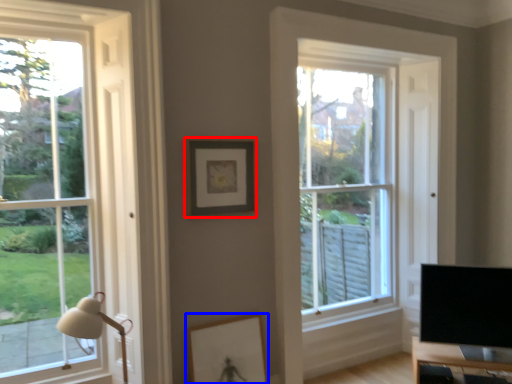
Question: Among these objects, which one is farthest to the camera, picture frame (highlighted by a red box) or picture frame (highlighted by a blue box)?

Choices:
 (A) picture frame
 (B) picture frame

Answer: (A)